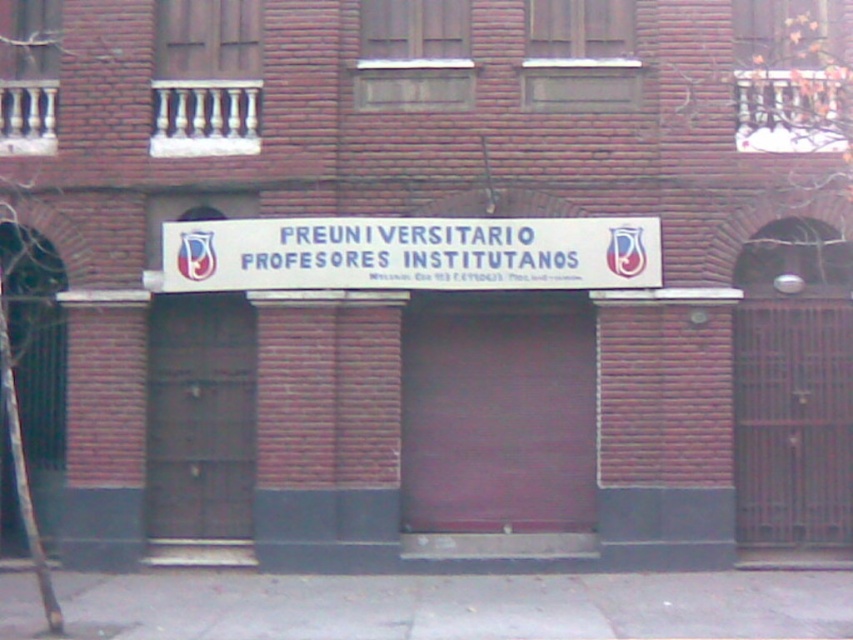
You are standing in front of the brick building and want to place a small potted plant exactly at the point labeled as point [461,605]. Based on the scene description, what surface will the potted plant be placed on?

The point [461,605] corresponds to gray concrete pavement at lower center, so the potted plant will be placed on the gray concrete pavement at lower center.

You are standing in front of the building and want to place a small potted plant between the gray concrete pavement at lower center and the white plastic sign at center. Which object should the plant be closer to if you want it to be nearer to the sign?

The gray concrete pavement at lower center is to the right of the white plastic sign at center, so placing the plant closer to the sign would mean positioning it near the white plastic sign at center.

You are a delivery person with a cart that is 2 meters wide. You need to navigate through the space between the gray concrete pavement at lower center and the white plastic sign at center to reach the entrance. Can your cart fit through this space?

The distance between the gray concrete pavement at lower center and the white plastic sign at center is 2.48 meters. Since your cart is 2 meters wide, it can fit through the space as the available width is greater than the cart width.